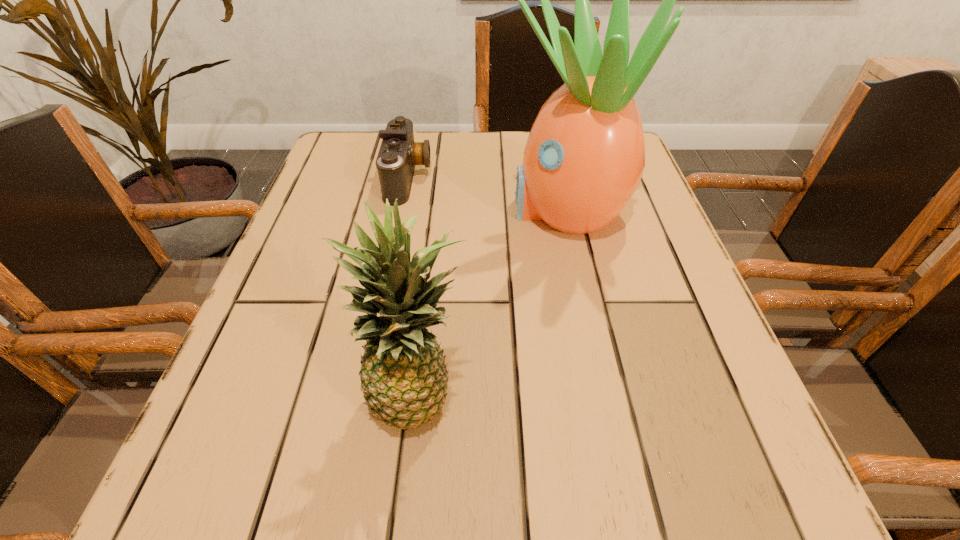
Where is `pineapple situated at the far edge`? pineapple situated at the far edge is located at coordinates (584, 158).

Where is `camera that is at the far edge`? camera that is at the far edge is located at coordinates (398, 154).

The width and height of the screenshot is (960, 540). Find the location of `object located in the left edge section of the desktop`. object located in the left edge section of the desktop is located at coordinates (398, 154).

Locate an element on the screen. Image resolution: width=960 pixels, height=540 pixels. object that is at the right edge is located at coordinates (584, 158).

The width and height of the screenshot is (960, 540). In order to click on object positioned at the far left corner in this screenshot , I will do `click(398, 154)`.

This screenshot has width=960, height=540. Find the location of `object at the far right corner`. object at the far right corner is located at coordinates (584, 158).

Where is `blank space at the far edge of the desktop`? The height and width of the screenshot is (540, 960). blank space at the far edge of the desktop is located at coordinates (431, 167).

This screenshot has width=960, height=540. In the image, there is a desktop. Find the location of `vacant space at the near edge`. vacant space at the near edge is located at coordinates (588, 485).

You are a GUI agent. You are given a task and a screenshot of the screen. Output one action in this format:
    pyautogui.click(x=<x>, y=<y>)
    Task: Click on the vacant space at the left edge of the desktop
    This screenshot has height=540, width=960.
    Given the screenshot: What is the action you would take?
    pyautogui.click(x=351, y=321)

Where is `vacant space at the right edge of the desktop`? This screenshot has height=540, width=960. vacant space at the right edge of the desktop is located at coordinates (616, 285).